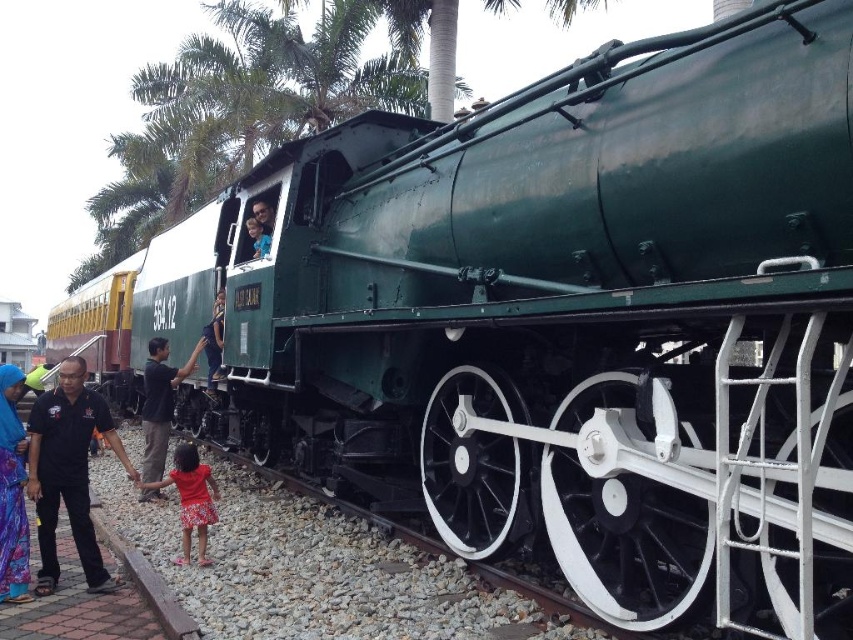
Who is more forward, (22, 512) or (204, 531)?

Point (22, 512)

This screenshot has height=640, width=853. Find the location of `printed fabric dress at lower left`. printed fabric dress at lower left is located at coordinates (12, 492).

You are a GUI agent. You are given a task and a screenshot of the screen. Output one action in this format:
    pyautogui.click(x=<x>, y=<y>)
    Task: Click on the printed fabric dress at lower left
    The height and width of the screenshot is (640, 853).
    Given the screenshot: What is the action you would take?
    pyautogui.click(x=12, y=492)

Between black shirt at left and blue fabric shirt at center, which one has less height?

blue fabric shirt at center is shorter.

Describe the element at coordinates (68, 472) in the screenshot. I see `black shirt at left` at that location.

Which is behind, point (107, 426) or point (257, 256)?

The point (257, 256) is behind.

Image resolution: width=853 pixels, height=640 pixels. What are the coordinates of `black shirt at left` in the screenshot? It's located at point(68,472).

Is dark green metal train at center wider than red floral dress at lower left?

In fact, dark green metal train at center might be narrower than red floral dress at lower left.

Can you confirm if dark green metal train at center is bigger than red floral dress at lower left?

Yes, dark green metal train at center is bigger than red floral dress at lower left.

Is point (148, 497) positioned in front of point (183, 492)?

No, (148, 497) is further to viewer.

The height and width of the screenshot is (640, 853). I want to click on dark green metal train at center, so click(160, 403).